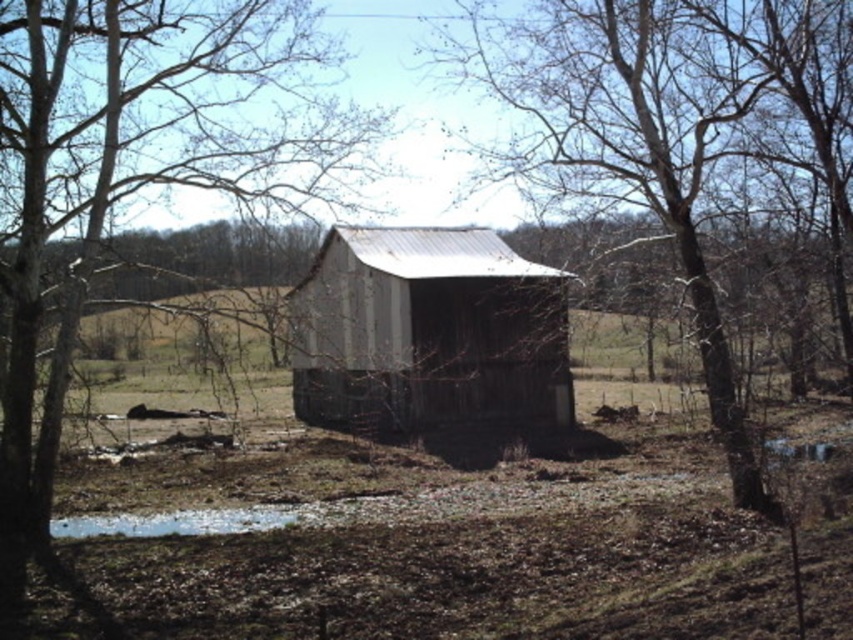
You are a gardener standing near the shed and want to place a new decorative rock in the foreground. Which object, the brown rough wood tree at center or the white matte puddle at lower center, is closer to you?

The brown rough wood tree at center is closer to you because it is in front of the white matte puddle at lower center.

You are a painter standing in the field and want to paint both the brown rough wood tree at center and the weathered wood barn at center. Which object should you move closer to if you want to capture more details of its structure in your painting?

The brown rough wood tree at center has a larger width than the weathered wood barn at center, so to capture more details of its structure, you should move closer to the brown rough wood tree at center.

You are standing at point (x=0, y=112) and want to walk to the shed. The shed is 16.27 meters away from you. Is the shed within a 20 meter walking distance?

The shed is 16.27 meters away from point (x=0, y=112), so yes, it is within a 20 meter walking distance.